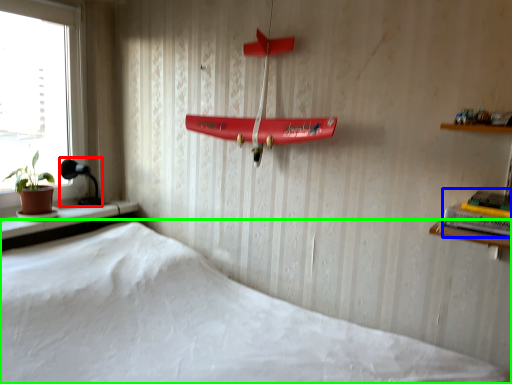
Question: Based on their relative distances, which object is nearer to lamp (highlighted by a red box)? Choose from book (highlighted by a blue box) and bed (highlighted by a green box).

Choices:
 (A) book
 (B) bed

Answer: (B)